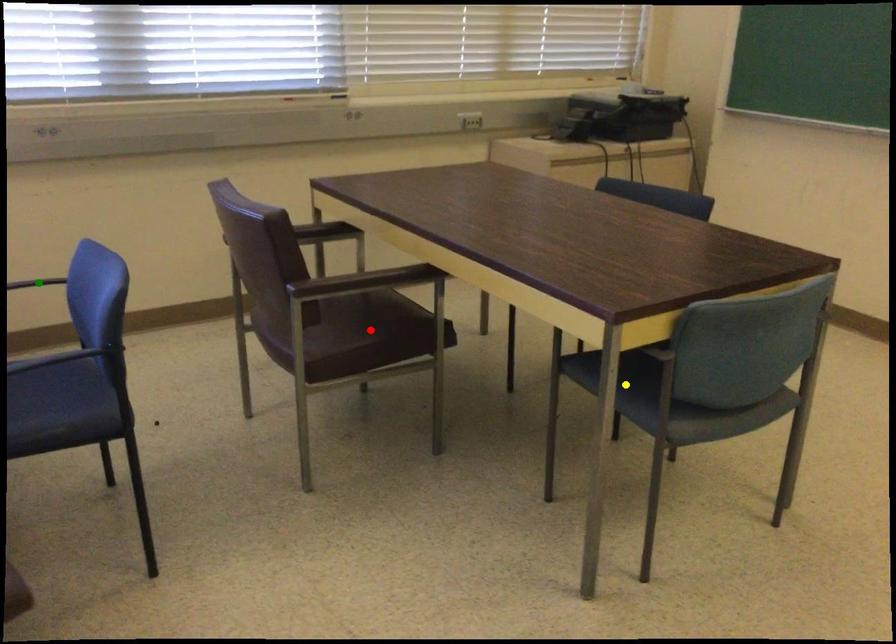
Order these from nearest to farthest:
green point | red point | yellow point

1. yellow point
2. red point
3. green point